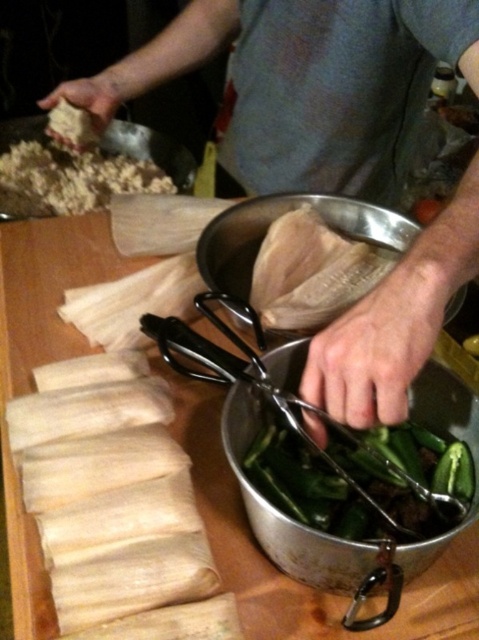
You are a food delivery robot with a 20 inch arm reach. You need to pick up the smooth beige tortilla at center from the table. Can your arm reach it?

The smooth beige tortilla at center is 18.51 inches away from the viewer, so yes, the robot can reach it with its 20 inch arm since it is within the reach range.

You are a food preparer and need to place the smooth beige tortilla at center and the white crumbly dough at upper left onto a tray. According to the image, which object should you place on the right side of the tray?

The smooth beige tortilla at center should be placed on the right side of the tray because it is already positioned on the right side of the white crumbly dough at upper left in the image.

You are a food preparer who needs to reach for either the smooth beige tortilla at center or the black metal tongs at center. Which object will you touch first if you extend your hand straight ahead?

The smooth beige tortilla at center is closer to the viewer than the black metal tongs at center, so you will touch the smooth beige tortilla at center first.